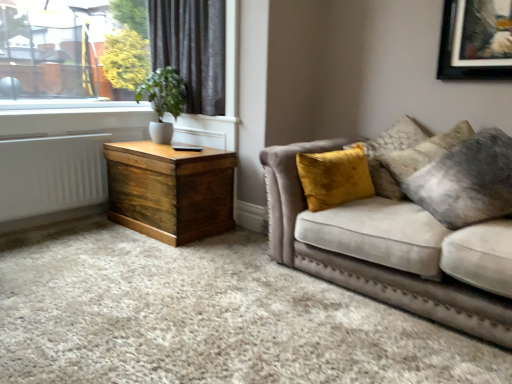
Question: Is wooden trunk at left with green matte plant at upper left?

Choices:
 (A) yes
 (B) no

Answer: (B)

Question: Is wooden trunk at left oriented away from green matte plant at upper left?

Choices:
 (A) yes
 (B) no

Answer: (B)

Question: Considering the relative positions of wooden trunk at left and green matte plant at upper left in the image provided, is wooden trunk at left in front of green matte plant at upper left?

Choices:
 (A) no
 (B) yes

Answer: (B)

Question: Is wooden trunk at left at the left side of green matte plant at upper left?

Choices:
 (A) no
 (B) yes

Answer: (A)

Question: Does wooden trunk at left lie behind green matte plant at upper left?

Choices:
 (A) yes
 (B) no

Answer: (B)

Question: From a real-world perspective, is white painted radiator at left physically located above or below velvet yellow pillow at right?

Choices:
 (A) above
 (B) below

Answer: (B)

Question: Is white painted radiator at left inside or outside of velvet yellow pillow at right?

Choices:
 (A) outside
 (B) inside

Answer: (A)

Question: Based on their positions, is white painted radiator at left located to the left or right of velvet yellow pillow at right?

Choices:
 (A) left
 (B) right

Answer: (A)

Question: Does point (74, 193) appear closer or farther from the camera than point (420, 178)?

Choices:
 (A) closer
 (B) farther

Answer: (B)

Question: From a real-world perspective, is dark grey velvet curtain at upper left positioned above or below velvet yellow pillow at right?

Choices:
 (A) above
 (B) below

Answer: (A)

Question: Is dark grey velvet curtain at upper left taller or shorter than velvet yellow pillow at right?

Choices:
 (A) tall
 (B) short

Answer: (A)

Question: Is dark grey velvet curtain at upper left wider or thinner than velvet yellow pillow at right?

Choices:
 (A) thin
 (B) wide

Answer: (A)

Question: Considering the positions of dark grey velvet curtain at upper left and velvet yellow pillow at right in the image, is dark grey velvet curtain at upper left bigger or smaller than velvet yellow pillow at right?

Choices:
 (A) small
 (B) big

Answer: (B)

Question: From the image's perspective, is dark grey velvet curtain at upper left positioned above or below wooden trunk at left?

Choices:
 (A) above
 (B) below

Answer: (A)

Question: In terms of height, does dark grey velvet curtain at upper left look taller or shorter compared to wooden trunk at left?

Choices:
 (A) tall
 (B) short

Answer: (A)